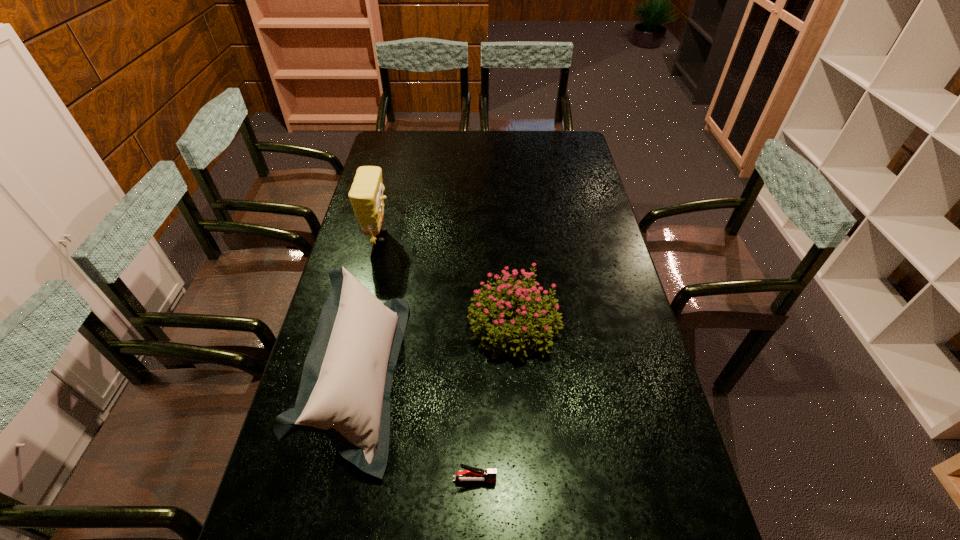
Identify the location of the farthest object. This screenshot has height=540, width=960. (366, 195).

Identify the location of bouquet. The width and height of the screenshot is (960, 540). (486, 314).

Identify the location of cushion. This screenshot has width=960, height=540. (344, 393).

Image resolution: width=960 pixels, height=540 pixels. Identify the location of the shortest object. (471, 474).

Image resolution: width=960 pixels, height=540 pixels. What are the coordinates of `free space located 0.400m on the face of the farthest object` in the screenshot? It's located at (506, 237).

Identify the location of free space located 0.270m on the left of the bouquet. (374, 326).

You are a GUI agent. You are given a task and a screenshot of the screen. Output one action in this format:
    pyautogui.click(x=<x>, y=<y>)
    Task: Click on the vacant region located on the surface of the cushion
    Image resolution: width=960 pixels, height=540 pixels.
    Given the screenshot: What is the action you would take?
    pyautogui.click(x=461, y=379)

You are a GUI agent. You are given a task and a screenshot of the screen. Output one action in this format:
    pyautogui.click(x=<x>, y=<y>)
    Task: Click on the free region located on the handle side of the shortest object
    The height and width of the screenshot is (540, 960).
    Given the screenshot: What is the action you would take?
    pyautogui.click(x=617, y=480)

Where is `sponge situated at the left edge`? sponge situated at the left edge is located at coordinates (366, 195).

Locate an element on the screen. Image resolution: width=960 pixels, height=540 pixels. cushion that is at the left edge is located at coordinates (344, 393).